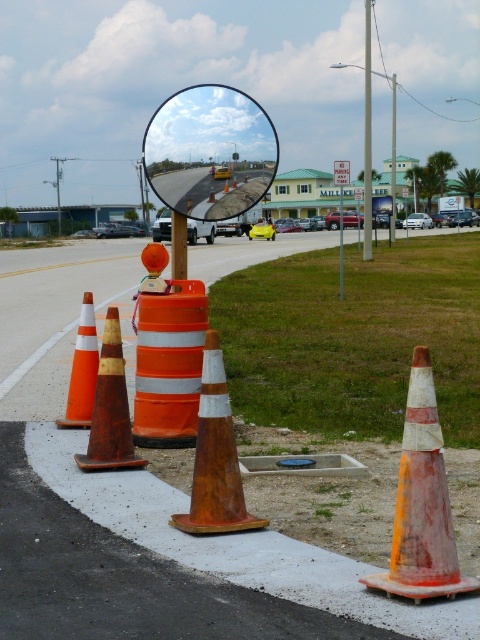
You are a delivery driver approaching the convex mirror at center. You see the orange reflective barrel at center and the rusty orange traffic cone at center. Which object is closer to you as you approach the mirror?

The orange reflective barrel at center is closer to you because it is further to the viewer than the rusty orange traffic cone at center, meaning it appears nearer in your line of sight.

You are a delivery driver who needs to park your vehicle between the orange reflective cone at lower left and the brushed metal pole at upper center. Considering their widths, which object will require more space to avoid collision with your vehicle?

The brushed metal pole at upper center requires more space because it has a greater width than the orange reflective cone at lower left.

You are a pedestrian standing at the roadside and want to walk to the brushed metal pole at upper center. There is an orange reflective cone at lower left in your path. Can you easily step around it?

The orange reflective cone at lower left is closer to the viewer than the brushed metal pole at upper center, so the cone is in your path. You can easily step around it as it is a single obstacle and not blocking the entire path.